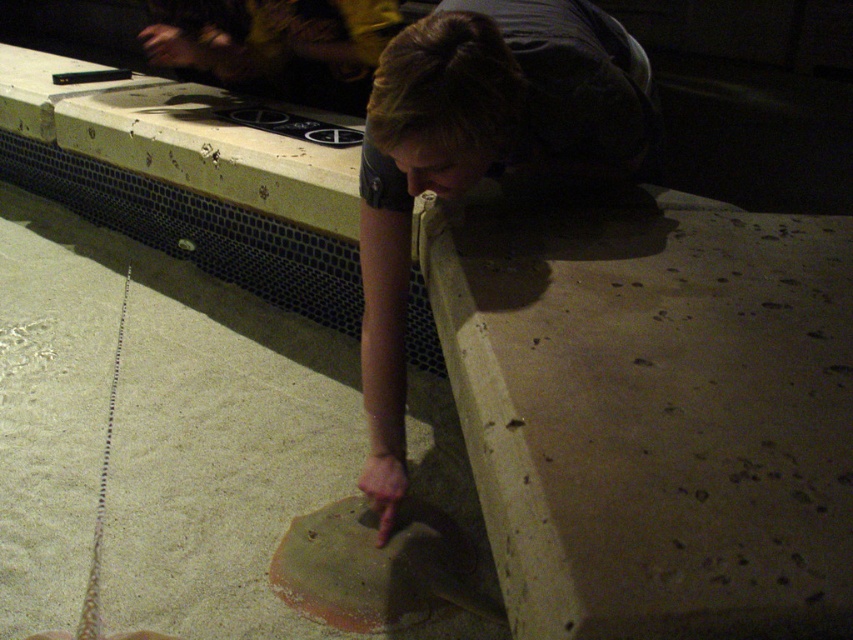
Does smooth concrete slab at lower right appear over smooth concrete hand at lower center?

No, smooth concrete slab at lower right is not above smooth concrete hand at lower center.

Is point (824, 394) more distant than point (483, 112)?

No, (824, 394) is closer to viewer.

Is point (793, 225) farther from viewer compared to point (439, 129)?

That is True.

Locate an element on the screen. This screenshot has height=640, width=853. smooth concrete slab at lower right is located at coordinates (653, 410).

Can you confirm if smooth concrete at lower center is positioned below smooth concrete hand at lower center?

Indeed, smooth concrete at lower center is positioned under smooth concrete hand at lower center.

The width and height of the screenshot is (853, 640). What do you see at coordinates (155, 433) in the screenshot? I see `smooth concrete at lower center` at bounding box center [155, 433].

Locate an element on the screen. The image size is (853, 640). smooth concrete at lower center is located at coordinates (155, 433).

Is smooth concrete slab at lower right taller than smooth concrete at lower center?

No, smooth concrete slab at lower right is not taller than smooth concrete at lower center.

Is smooth concrete slab at lower right positioned behind smooth concrete at lower center?

That is False.

Identify the location of smooth concrete slab at lower right. (653, 410).